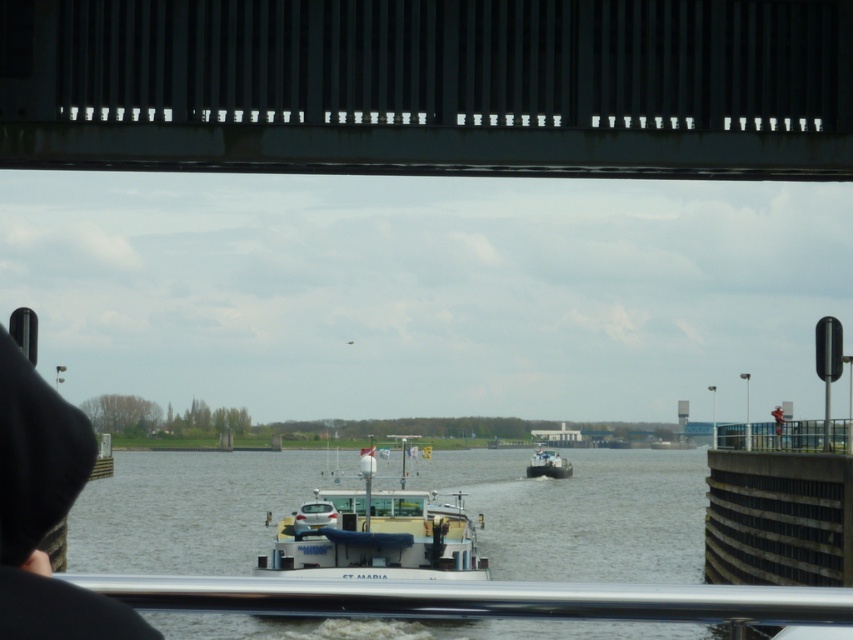
You are standing under the bridge and want to take a photo of the white matte barge at center without including the silver metallic rail at lower center in the frame. Based on their positions, which side of the barge should you move to in order to avoid the rail?

Since the silver metallic rail at lower center is positioned on the right side of white matte barge at center, you should move to the left side of the white matte barge at center to avoid including the rail in your photo.